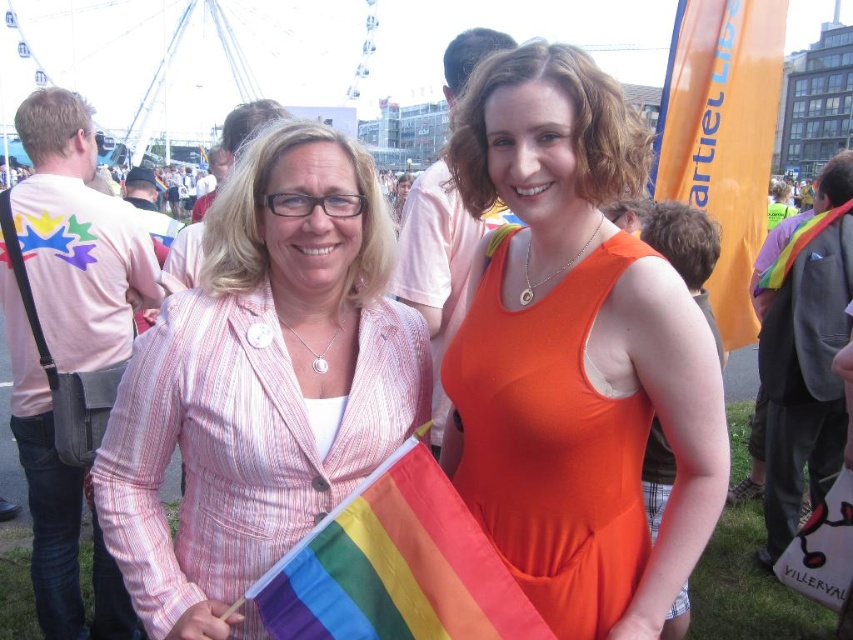
You are at a festival and want to find the rainbow fabric flag at center and the orange fabric flag at upper right. If you are facing the Ferris wheel in the background, which flag is closer to your left side?

The rainbow fabric flag at center is closer to your left side because it is positioned to the left of the orange fabric flag at upper right.

You are attending a festival and notice the pink striped blazer at center. Can you determine its exact location in the image using the coordinate system provided?

The pink striped blazer at center is located at point [260,384].

You are a photographer at the event and want to capture both the pink striped blazer at center and the rainbow fabric flag at center in a single frame. Given that your camera has a fixed focus, which object should you prioritize to ensure it appears clearer in the photo?

The pink striped blazer at center should be prioritized because its width is larger than the rainbow fabric flag at center, making it more prominent and easier to focus on in the frame.